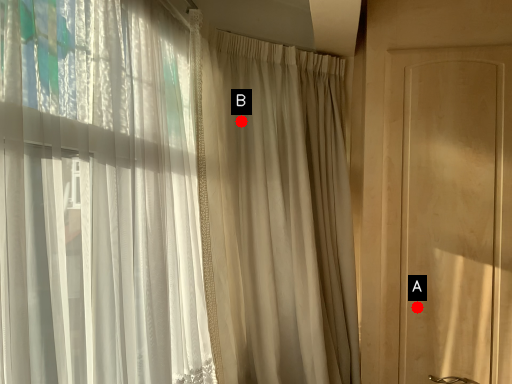
Question: Two points are circled on the image, labeled by A and B beside each circle. Which point appears farthest from the camera in this image?

Choices:
 (A) A is further
 (B) B is further

Answer: (B)